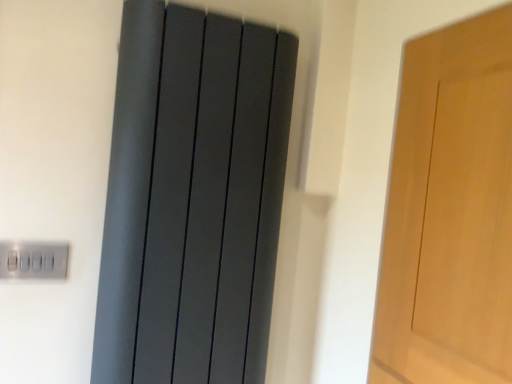
Question: Considering the relative sizes of satin silver switch at lower left and matte gray radiator at center in the image provided, is satin silver switch at lower left taller than matte gray radiator at center?

Choices:
 (A) yes
 (B) no

Answer: (B)

Question: Is satin silver switch at lower left at the right side of matte gray radiator at center?

Choices:
 (A) no
 (B) yes

Answer: (A)

Question: From the image's perspective, is satin silver switch at lower left beneath matte gray radiator at center?

Choices:
 (A) yes
 (B) no

Answer: (A)

Question: From a real-world perspective, is satin silver switch at lower left on top of matte gray radiator at center?

Choices:
 (A) no
 (B) yes

Answer: (A)

Question: Does satin silver switch at lower left turn towards matte gray radiator at center?

Choices:
 (A) no
 (B) yes

Answer: (A)

Question: Is satin silver switch at lower left positioned behind matte gray radiator at center?

Choices:
 (A) no
 (B) yes

Answer: (B)

Question: Is matte gray radiator at center smaller than satin silver switch at lower left?

Choices:
 (A) yes
 (B) no

Answer: (B)

Question: Is matte gray radiator at center surrounding satin silver switch at lower left?

Choices:
 (A) no
 (B) yes

Answer: (A)

Question: Is matte gray radiator at center bigger than satin silver switch at lower left?

Choices:
 (A) yes
 (B) no

Answer: (A)

Question: From the image's perspective, is matte gray radiator at center above satin silver switch at lower left?

Choices:
 (A) no
 (B) yes

Answer: (B)

Question: Considering the relative positions of matte gray radiator at center and satin silver switch at lower left in the image provided, is matte gray radiator at center to the left of satin silver switch at lower left from the viewer's perspective?

Choices:
 (A) no
 (B) yes

Answer: (A)

Question: From a real-world perspective, is matte gray radiator at center on top of satin silver switch at lower left?

Choices:
 (A) yes
 (B) no

Answer: (A)

Question: From their relative heights in the image, would you say satin silver switch at lower left is taller or shorter than matte gray radiator at center?

Choices:
 (A) tall
 (B) short

Answer: (B)